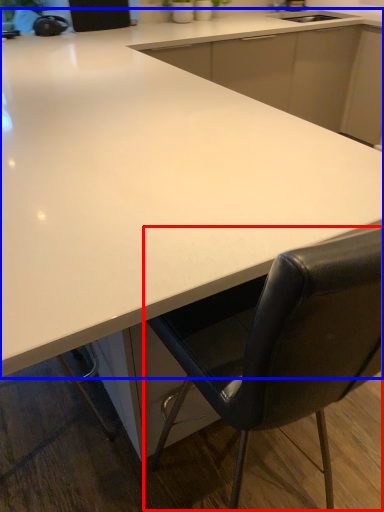
Question: Which of the following is the farthest to the observer, chair (highlighted by a red box) or countertop (highlighted by a blue box)?

Choices:
 (A) chair
 (B) countertop

Answer: (B)